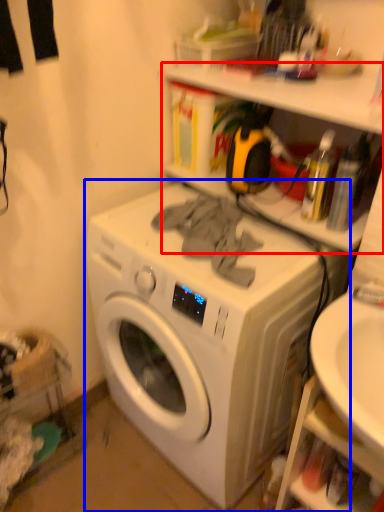
Question: Which object appears farthest to the camera in this image, shelf (highlighted by a red box) or washing machine (highlighted by a blue box)?

Choices:
 (A) shelf
 (B) washing machine

Answer: (A)